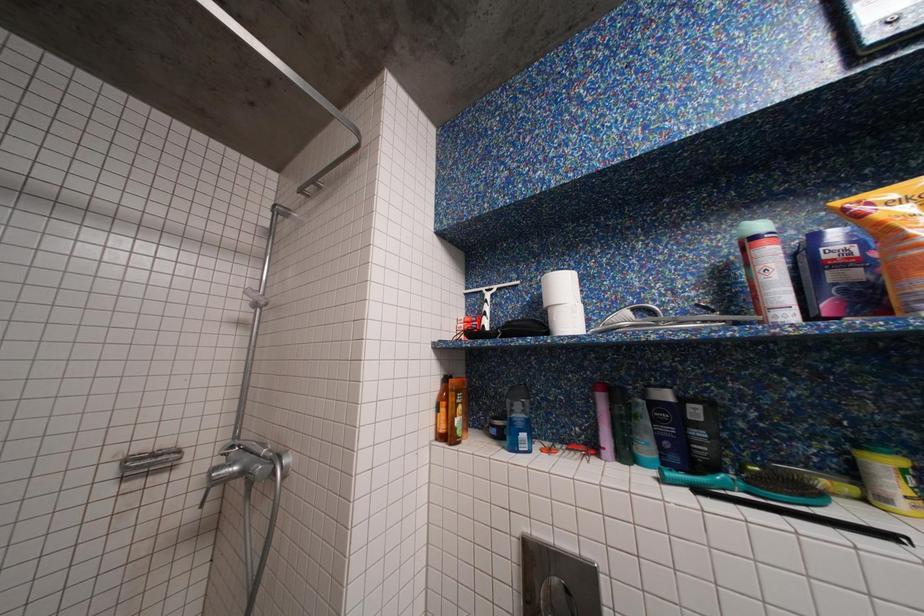
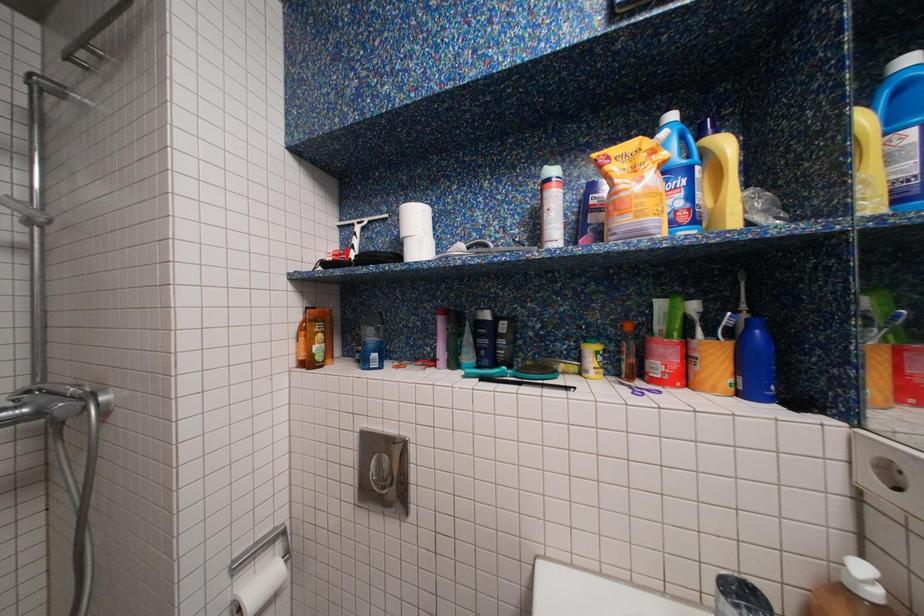
Question: The camera is either moving clockwise (left) or counter-clockwise (right) around the object. The first image is from the beginning of the video and the second image is from the end. Is the camera moving left or right when shooting the video?

Choices:
 (A) Left
 (B) Right

Answer: (A)